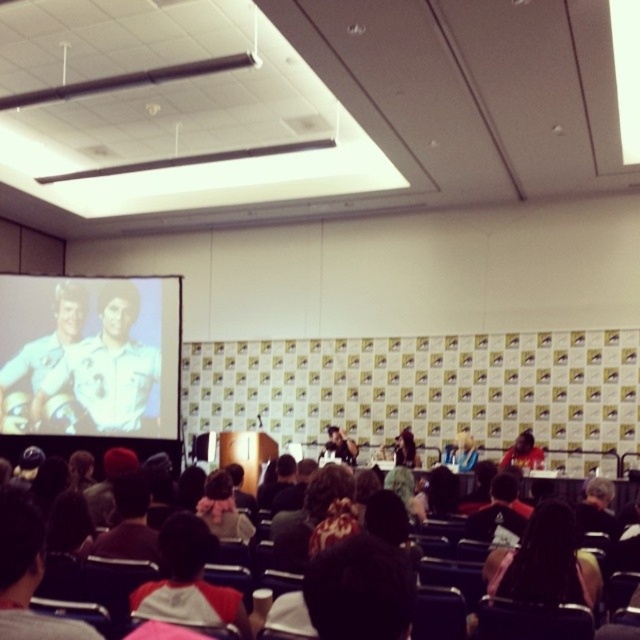
Does matte white screen at upper left appear on the right side of white cotton shirt at center?

No, matte white screen at upper left is not to the right of white cotton shirt at center.

Between point (24, 349) and point (212, 548), which one is positioned in front?

Positioned in front is point (212, 548).

You are a GUI agent. You are given a task and a screenshot of the screen. Output one action in this format:
    pyautogui.click(x=<x>, y=<y>)
    Task: Click on the matte white screen at upper left
    This screenshot has height=640, width=640.
    Given the screenshot: What is the action you would take?
    click(x=90, y=355)